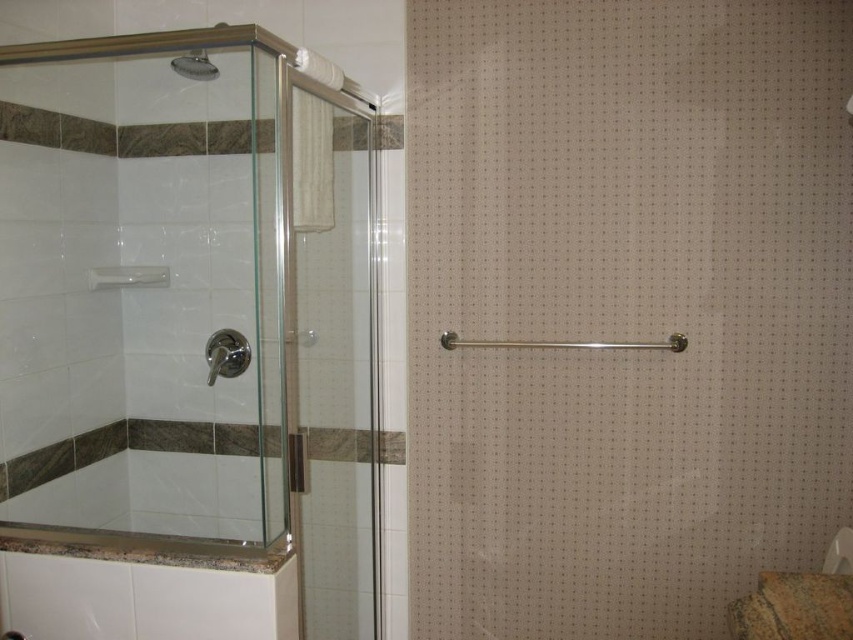
Question: Which point is closer to the camera?

Choices:
 (A) brown marble toilet bowl at lower right
 (B) brushed metal showerhead at left

Answer: (A)

Question: Is brushed metal showerhead at left to the left of brushed metal shower head at upper left from the viewer's perspective?

Choices:
 (A) no
 (B) yes

Answer: (A)

Question: Where is brown marble toilet bowl at lower right located in relation to brushed metal showerhead at left in the image?

Choices:
 (A) below
 (B) above

Answer: (A)

Question: Is clear glass shower door at left to the left of brown marble toilet bowl at lower right from the viewer's perspective?

Choices:
 (A) no
 (B) yes

Answer: (B)

Question: Which is farther from the clear glass shower door at left?

Choices:
 (A) brushed metal showerhead at left
 (B) brown marble toilet bowl at lower right
 (C) brushed metal shower head at upper left

Answer: (B)

Question: Estimate the real-world distances between objects in this image. Which object is closer to the clear glass shower door at left?

Choices:
 (A) brushed metal showerhead at left
 (B) brushed metal shower head at upper left

Answer: (A)